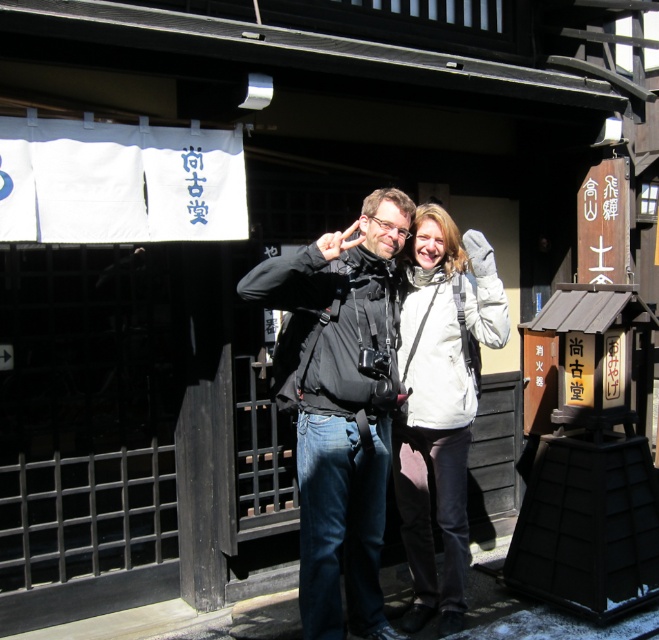
Question: Does black matte jacket at center appear on the left side of white matte jacket at center?

Choices:
 (A) no
 (B) yes

Answer: (B)

Question: Which of the following is the farthest from the observer?

Choices:
 (A) white matte jacket at center
 (B) black matte jacket at center

Answer: (A)

Question: Which point is closer to the camera taking this photo?

Choices:
 (A) (376, 336)
 (B) (453, 237)

Answer: (A)

Question: Does black matte jacket at center come in front of white matte jacket at center?

Choices:
 (A) no
 (B) yes

Answer: (B)

Question: Can you confirm if black matte jacket at center is smaller than white matte jacket at center?

Choices:
 (A) yes
 (B) no

Answer: (B)

Question: Which point is farther to the camera?

Choices:
 (A) black matte jacket at center
 (B) white matte jacket at center

Answer: (B)